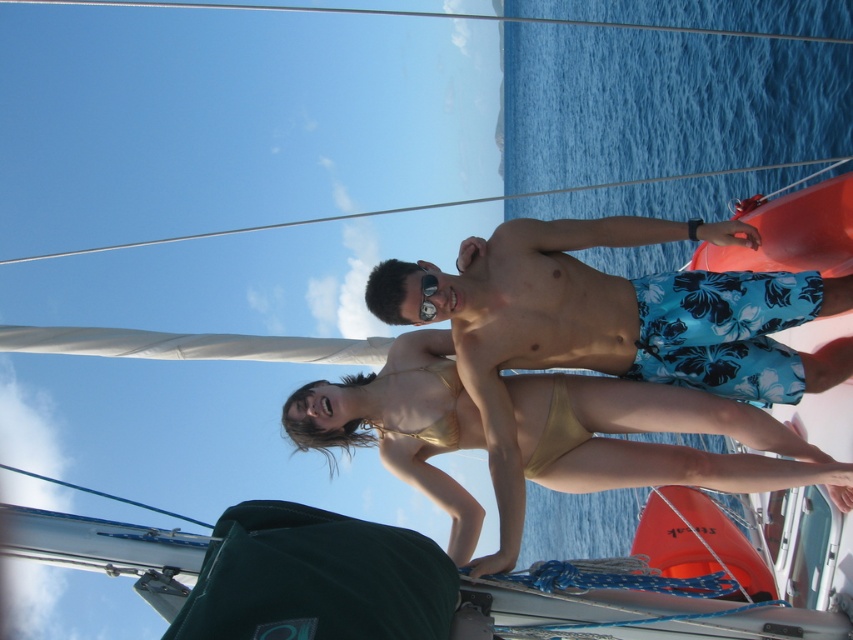
Question: Among these objects, which one is farthest from the camera?

Choices:
 (A) gold/yellow bikini bottom at center
 (B) blue floral swim trunks at center
 (C) matte black goggles at center
 (D) gold/yellow fabric bikini top at center

Answer: (D)

Question: Does blue floral swim trunks at center appear on the left side of blue floral swim trunks at right?

Choices:
 (A) no
 (B) yes

Answer: (B)

Question: Does blue floral swim trunks at center have a greater width compared to matte black goggles at center?

Choices:
 (A) no
 (B) yes

Answer: (B)

Question: In this image, where is blue floral swim trunks at center located relative to gold/yellow fabric bikini top at center?

Choices:
 (A) right
 (B) left

Answer: (A)

Question: Which of the following is the closest to the observer?

Choices:
 (A) matte black goggles at center
 (B) blue floral swim trunks at center
 (C) gold/yellow fabric bikini top at center

Answer: (B)

Question: Among these points, which one is farthest from the camera?

Choices:
 (A) (752, 618)
 (B) (456, 438)
 (C) (633, 464)
 (D) (421, 282)

Answer: (B)